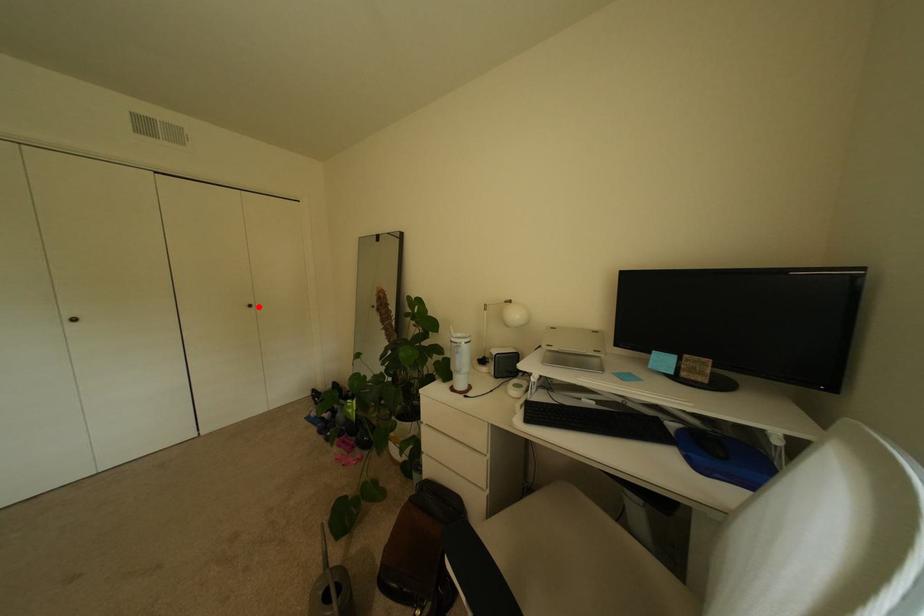
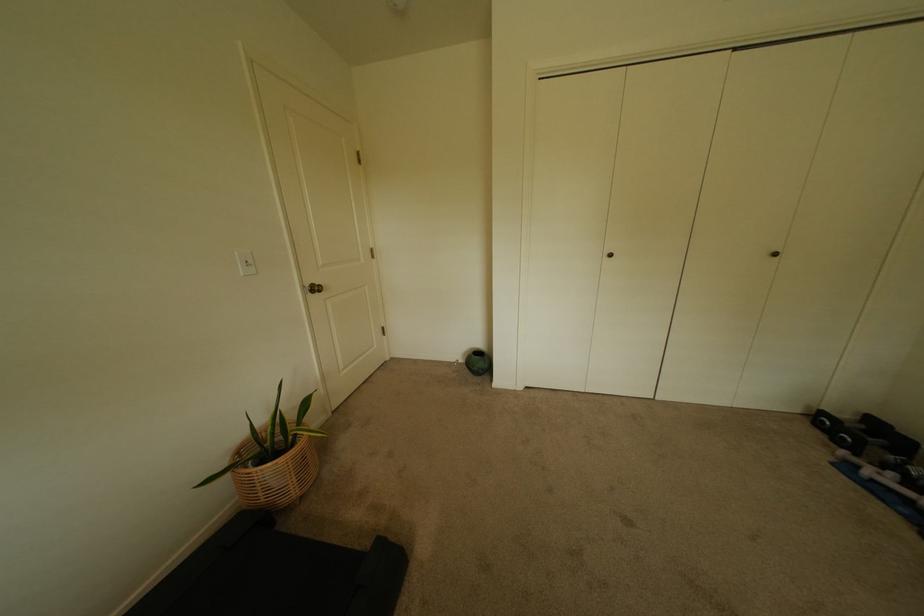
Find the pixel in the second image that matches the highlighted location in the first image.

(784, 256)